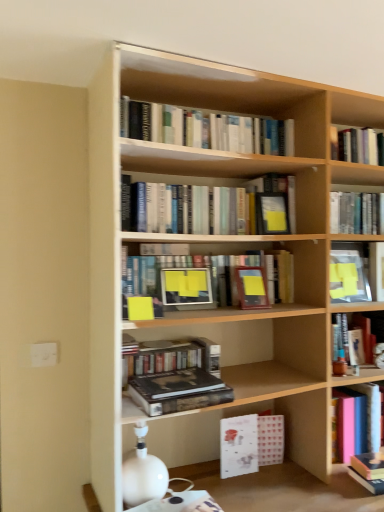
Question: From a real-world perspective, is light wood bookcase at center positioned under hardcover book at upper center, which is the second book in top-to-bottom order, based on gravity?

Choices:
 (A) yes
 (B) no

Answer: (A)

Question: From a real-world perspective, does light wood bookcase at center stand above hardcover book at upper center, the seventh book from the bottom?

Choices:
 (A) yes
 (B) no

Answer: (B)

Question: Is light wood bookcase at center positioned with its back to hardcover book at upper center, which is the second book in top-to-bottom order?

Choices:
 (A) no
 (B) yes

Answer: (B)

Question: Is light wood bookcase at center facing towards hardcover book at upper center, which is the second book in top-to-bottom order?

Choices:
 (A) no
 (B) yes

Answer: (B)

Question: From the image's perspective, would you say light wood bookcase at center is shown under hardcover book at upper center, the seventh book from the bottom?

Choices:
 (A) no
 (B) yes

Answer: (B)

Question: From the image's perspective, would you say light wood bookcase at center is positioned over hardcover book at upper center, the seventh book from the bottom?

Choices:
 (A) no
 (B) yes

Answer: (A)

Question: Is matte wooden frame at center, which appears as the fourth book when ordered from the bottom, far away from hardcover book at upper center, which is the second book in top-to-bottom order?

Choices:
 (A) yes
 (B) no

Answer: (B)

Question: Is matte wooden frame at center, which appears as the fourth book when ordered from the bottom, shorter than hardcover book at upper center, the seventh book from the bottom?

Choices:
 (A) no
 (B) yes

Answer: (A)

Question: Can you confirm if matte wooden frame at center, which appears as the fourth book when ordered from the bottom, is thinner than hardcover book at upper center, the seventh book from the bottom?

Choices:
 (A) yes
 (B) no

Answer: (A)

Question: Considering the relative sizes of matte wooden frame at center, the 5th book in the top-to-bottom sequence, and hardcover book at upper center, the seventh book from the bottom, in the image provided, is matte wooden frame at center, the 5th book in the top-to-bottom sequence, smaller than hardcover book at upper center, the seventh book from the bottom,?

Choices:
 (A) yes
 (B) no

Answer: (B)

Question: Is matte wooden frame at center, the 5th book in the top-to-bottom sequence, next to hardcover book at upper center, the seventh book from the bottom, and touching it?

Choices:
 (A) yes
 (B) no

Answer: (B)

Question: Could hardcover book at upper center, which is the second book in top-to-bottom order, be considered to be inside matte wooden frame at center, the 5th book in the top-to-bottom sequence?

Choices:
 (A) yes
 (B) no

Answer: (B)

Question: Is hardcover book at right, the sixth book in the top-to-bottom sequence, outside light wood bookcase at center?

Choices:
 (A) no
 (B) yes

Answer: (A)